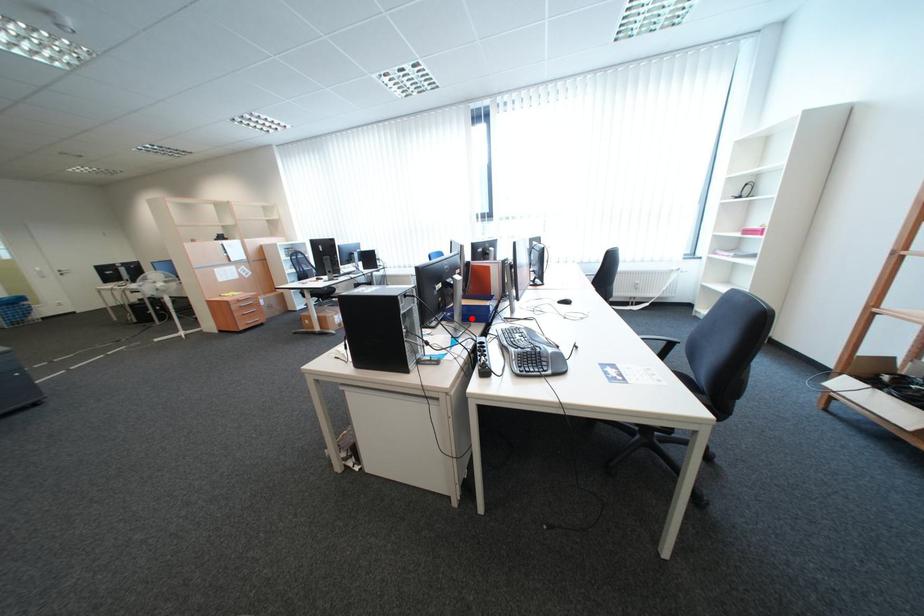
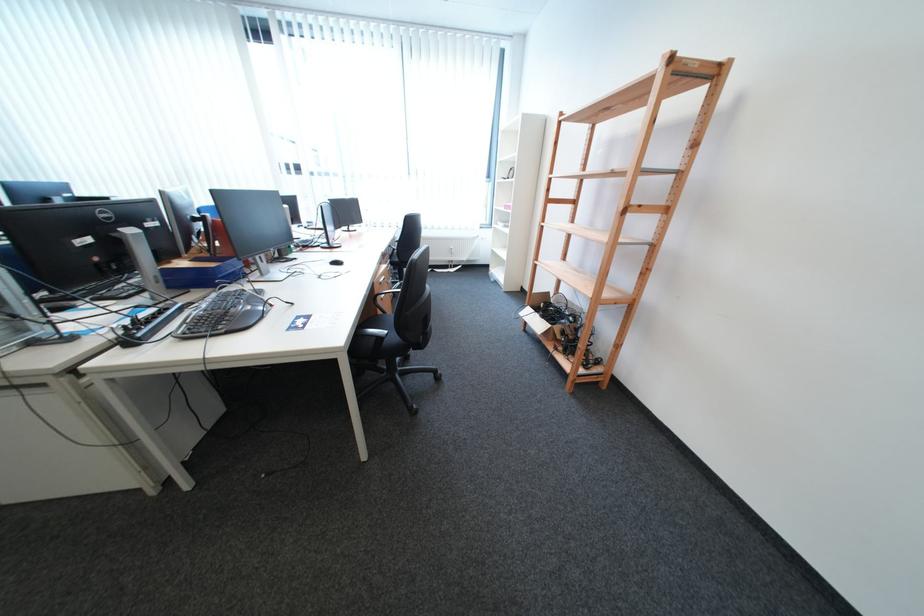
The point at the highlighted location is marked in the first image. Where is the corresponding point in the second image?

(169, 283)